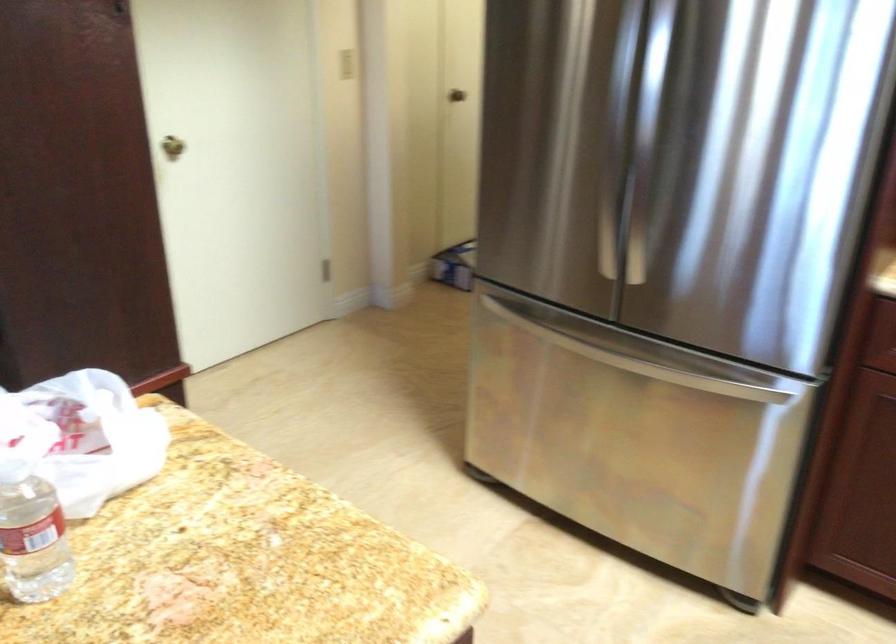
What do you see at coordinates (347, 64) in the screenshot? I see `the white light switch` at bounding box center [347, 64].